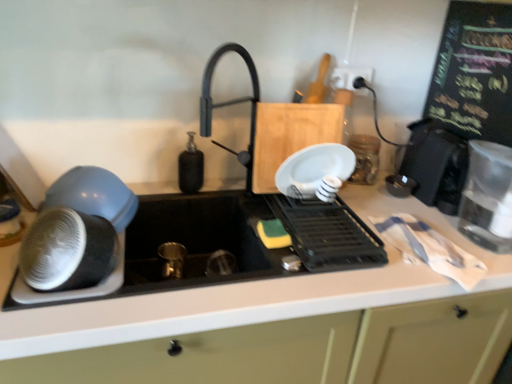
Identify the location of vacant area on top of white matte countertop at center (from a real-world perspective). The width and height of the screenshot is (512, 384). (322, 226).